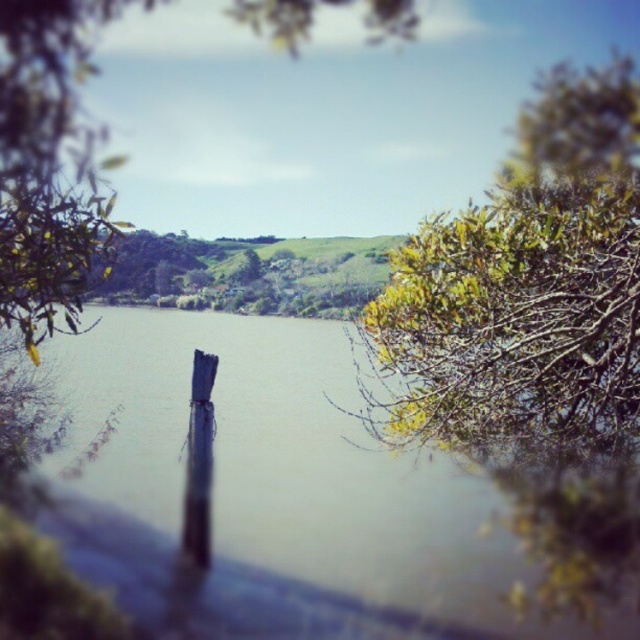
You are standing at the riverside and see the green leafy branches at upper right and the green leafy tree at upper right. Which one is closer to the water surface?

The green leafy branches at upper right is positioned under the green leafy tree at upper right, so the green leafy branches at upper right is closer to the water surface.

You are a painter standing 1.5 meters away from the brown wood post at center. You want to paint the green leafy branches at upper right. Can you reach them without moving closer?

The distance between the brown wood post at center and the green leafy branches at upper right is 2.14 meters. Since you are already 1.5 meters away from the post, the total distance to the branches would be 1.5 meters plus 2.14 meters, totaling 3.64 meters. Most standard paintbrushes have handles around 30 cm to 1 meter long, so reaching 3.64 meters is not feasible without moving closer.

You are a painter setting up your easel to capture the riverside scene. You want to ensure the brown wood post at center and the green leafy branches at upper right are both visible in your painting. Given their sizes, which object should you place closer to the center of your canvas to maintain balance?

The brown wood post at center has a larger size compared to the green leafy branches at upper right. To maintain balance, you should place the larger brown wood post at center closer to the center of your canvas and the smaller green leafy branches at upper right further out.